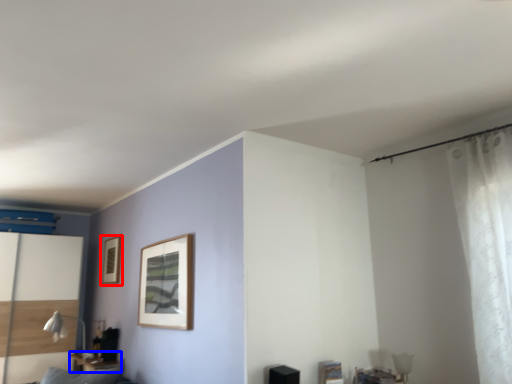
Question: Which object appears farthest to the camera in this image, picture frame (highlighted by a red box) or table (highlighted by a blue box)?

Choices:
 (A) picture frame
 (B) table

Answer: (A)